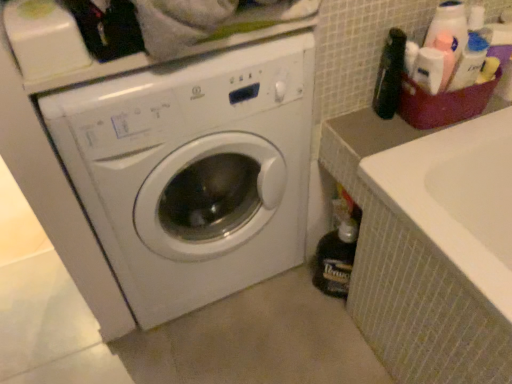
Where is `vacant area that is in front of black plastic bottle at upper right, which is the 2th bottle in back-to-front order`? vacant area that is in front of black plastic bottle at upper right, which is the 2th bottle in back-to-front order is located at coordinates (384, 137).